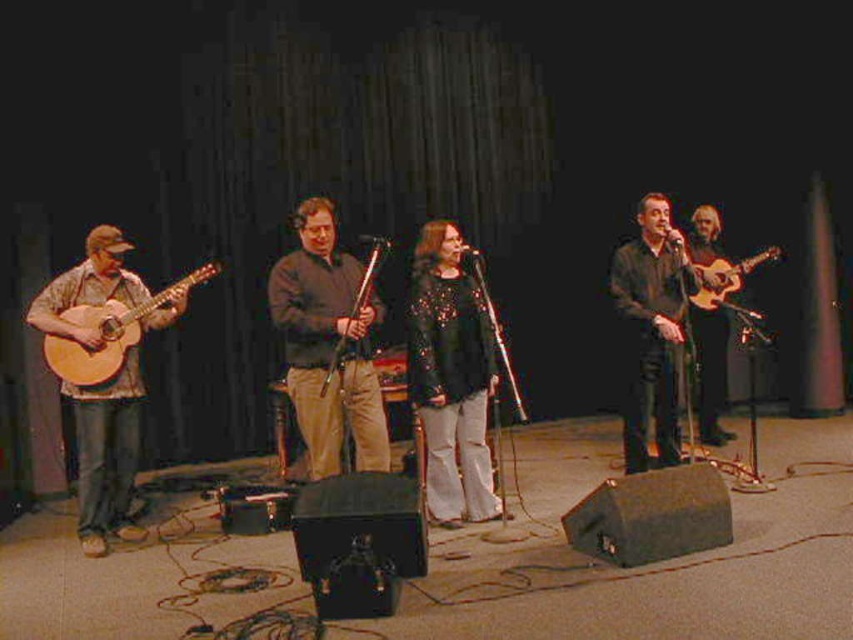
Based on the coordinates provided, which object is located at point [107,454]?

The point [107,454] corresponds to the matte brown acoustic guitar at left.

You are a stagehand preparing to move the matte brown acoustic guitar at left and the light brown acoustic guitar at right. Which guitar should you lift first if you need to place the taller one on a higher shelf?

The matte brown acoustic guitar at left is much taller than the light brown acoustic guitar at right, so you should lift the matte brown acoustic guitar at left first to place it on the higher shelf.

You are a stagehand who needs to move the matte brown guitar at left closer to the banjo player. The stage has limited space, and you must ensure that the distance between the guitar and the banjo player is at least 10 feet for safety. Can you move the guitar closer while maintaining this minimum distance?

The current distance between the matte brown guitar at left and the banjo player is 13.21 feet. Since the required minimum distance is 10 feet, you can move the guitar closer by up to 3.21 feet while still maintaining the safety requirement.